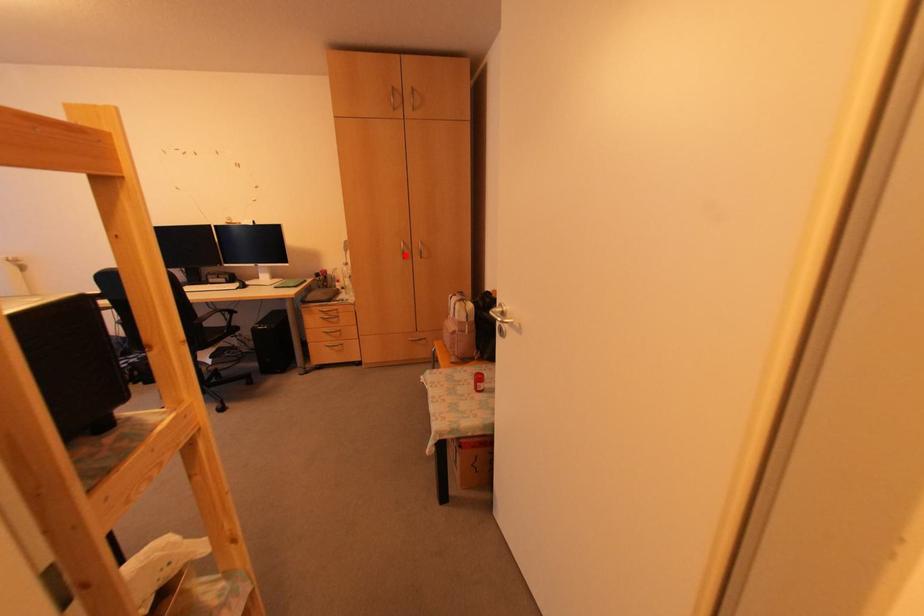
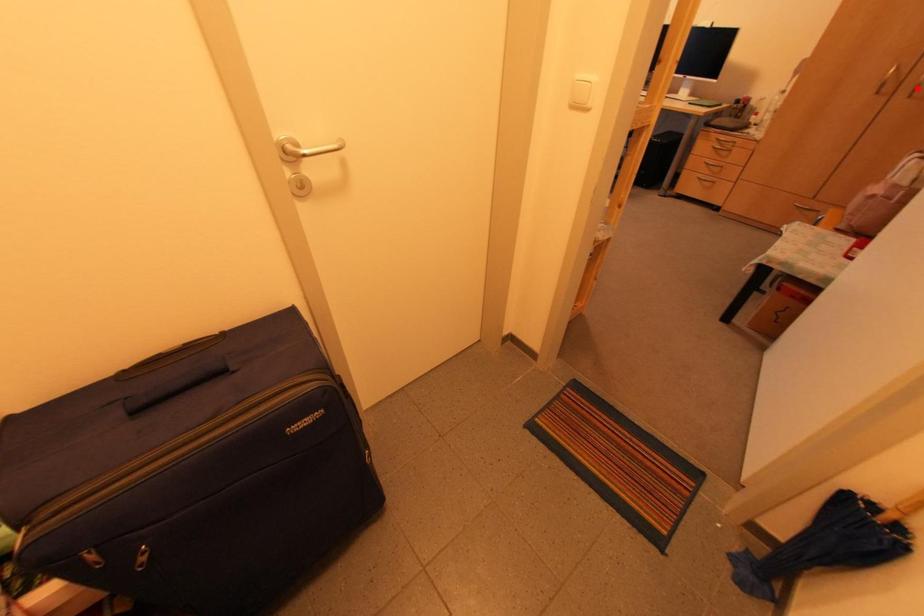
I am providing you with two images of the same scene from different viewpoints. A red point is marked on the first image and another point is marked on the second image. Is the marked point in image1 the same physical position as the marked point in image2?

No